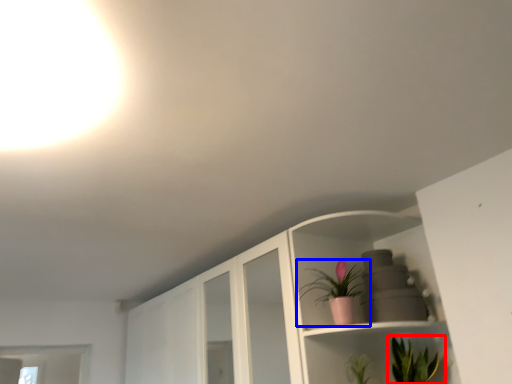
Question: Which object is closer to the camera taking this photo, houseplant (highlighted by a red box) or houseplant (highlighted by a blue box)?

Choices:
 (A) houseplant
 (B) houseplant

Answer: (A)